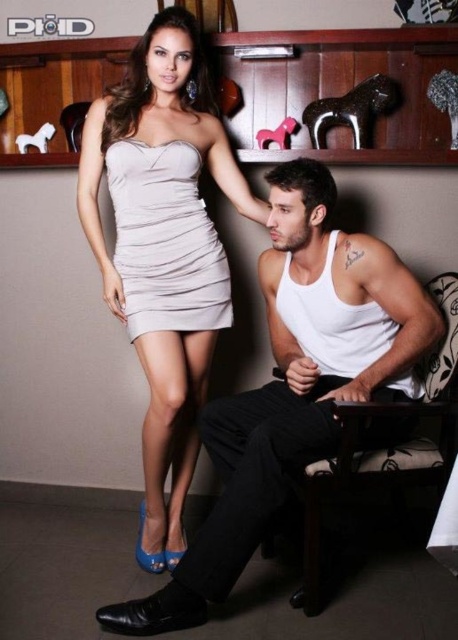
Question: Which object is farther from the camera taking this photo?

Choices:
 (A) white matte tank top at center
 (B) satin dress at center
 (C) white fabric chair at lower right
 (D) satin beige dress at upper left

Answer: (B)

Question: Can you confirm if white matte tank top at center is wider than white fabric chair at lower right?

Choices:
 (A) yes
 (B) no

Answer: (A)

Question: Which is farther from the white fabric chair at lower right?

Choices:
 (A) satin beige dress at upper left
 (B) white matte tank top at center

Answer: (A)

Question: Can you confirm if white matte tank top at center is smaller than satin beige dress at upper left?

Choices:
 (A) yes
 (B) no

Answer: (B)

Question: Is satin beige dress at upper left to the left of satin dress at center from the viewer's perspective?

Choices:
 (A) no
 (B) yes

Answer: (A)

Question: Which of the following is the closest to the observer?

Choices:
 (A) (401, 480)
 (B) (310, 232)
 (C) (218, 316)

Answer: (A)